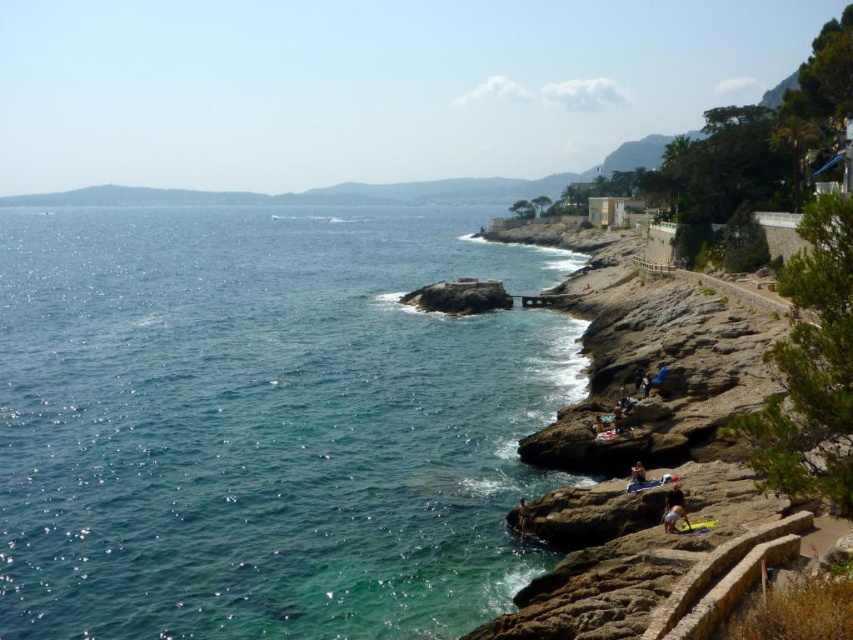
Question: Does brown rock at lower right have a larger size compared to rusty stone at center?

Choices:
 (A) yes
 (B) no

Answer: (A)

Question: Estimate the real-world distances between objects in this image. Which object is farther from the rusty stone at center?

Choices:
 (A) light blue denim shorts at lower center
 (B) brown rock at lower right

Answer: (A)

Question: Which of the following is the farthest from the observer?

Choices:
 (A) (250, 211)
 (B) (683, 522)

Answer: (A)

Question: Which point appears farthest from the camera in this image?

Choices:
 (A) (440, 301)
 (B) (404, 438)
 (C) (683, 524)

Answer: (A)

Question: Where is brown rock at lower right located in relation to rusty stone at center in the image?

Choices:
 (A) right
 (B) left

Answer: (A)

Question: Is clear blue water at left wider than dark blue fabric at lower center?

Choices:
 (A) no
 (B) yes

Answer: (B)